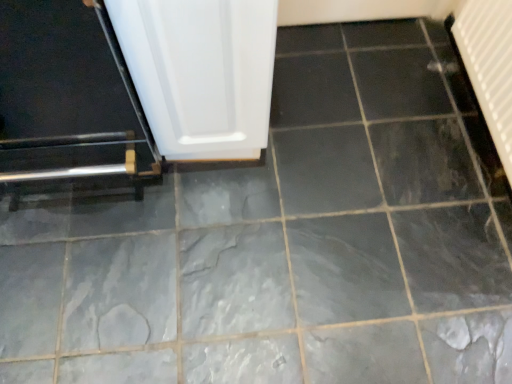
Where is `white glossy door at center`? The image size is (512, 384). white glossy door at center is located at coordinates (201, 73).

Does metallic silver door at left touch white textured radiator at upper right?

metallic silver door at left and white textured radiator at upper right are clearly separated.

Considering their positions, is metallic silver door at left located in front of or behind white textured radiator at upper right?

Clearly, metallic silver door at left is in front of white textured radiator at upper right.

Does point (10, 91) appear closer or farther from the camera than point (484, 45)?

Point (10, 91) is positioned closer to the camera compared to point (484, 45).

From the image's perspective, which is above, metallic silver door at left or white textured radiator at upper right?

metallic silver door at left appears higher in the image.

Is metallic silver door at left at the back of white glossy door at center?

That's not correct — white glossy door at center is not looking away from metallic silver door at left.

Is the surface of white glossy door at center in direct contact with metallic silver door at left?

No, white glossy door at center is not beside metallic silver door at left.

Is white glossy door at center smaller than metallic silver door at left?

Yes.

From a real-world perspective, is white glossy door at center on top of metallic silver door at left?

No, from a real-world perspective, white glossy door at center is not above metallic silver door at left.

Between metallic silver door at left and white glossy door at center, which one appears on the right side from the viewer's perspective?

From the viewer's perspective, white glossy door at center appears more on the right side.

From a real-world perspective, is metallic silver door at left on white glossy door at center?

Yes.

Is metallic silver door at left further to the viewer compared to white glossy door at center?

No, it is in front of white glossy door at center.

Does point (119, 115) appear closer or farther from the camera than point (197, 143)?

Point (119, 115) is positioned closer to the camera compared to point (197, 143).

Locate an element on the screen. The width and height of the screenshot is (512, 384). screen door that appears above the white textured radiator at upper right (from the image's perspective) is located at coordinates (x=201, y=73).

Does white glossy door at center come behind white textured radiator at upper right?

No, it is in front of white textured radiator at upper right.

From the image's perspective, is white textured radiator at upper right under white glossy door at center?

Yes, from the image's perspective, white textured radiator at upper right is below white glossy door at center.

Who is shorter, white textured radiator at upper right or white glossy door at center?

Standing shorter between the two is white textured radiator at upper right.

Is white textured radiator at upper right directly adjacent to white glossy door at center?

No, white textured radiator at upper right is not in contact with white glossy door at center.

Does white textured radiator at upper right appear on the right side of white glossy door at center?

Indeed, white textured radiator at upper right is positioned on the right side of white glossy door at center.

Considering the positions of objects white textured radiator at upper right and metallic silver door at left in the image provided, who is in front, white textured radiator at upper right or metallic silver door at left?

metallic silver door at left is closer to the camera.

Are white textured radiator at upper right and metallic silver door at left located far from each other?

That's right, there is a large distance between white textured radiator at upper right and metallic silver door at left.

Who is shorter, white textured radiator at upper right or metallic silver door at left?

white textured radiator at upper right.

Where is `radiator on the right side of metallic silver door at left`? radiator on the right side of metallic silver door at left is located at coordinates (487, 65).

This screenshot has height=384, width=512. In order to click on door that is above the white textured radiator at upper right (from a real-world perspective) in this screenshot , I will do `click(68, 104)`.

At what (x,y) coordinates should I click in order to perform the action: click on door in front of the white glossy door at center. Please return your answer as a coordinate pair (x, y). The image size is (512, 384). Looking at the image, I should click on (68, 104).

Looking at the image, which one is located closer to white glossy door at center, white textured radiator at upper right or metallic silver door at left?

Among the two, metallic silver door at left is located nearer to white glossy door at center.

When comparing their distances from white textured radiator at upper right, does metallic silver door at left or white glossy door at center seem further?

metallic silver door at left is positioned further to the anchor white textured radiator at upper right.

When comparing their distances from metallic silver door at left, does white textured radiator at upper right or white glossy door at center seem further?

Among the two, white textured radiator at upper right is located further to metallic silver door at left.

Which object lies further to the anchor point white glossy door at center, metallic silver door at left or white textured radiator at upper right?

The object further to white glossy door at center is white textured radiator at upper right.

From the image, which object appears to be nearer to metallic silver door at left, white glossy door at center or white textured radiator at upper right?

Among the two, white glossy door at center is located nearer to metallic silver door at left.

Based on their spatial positions, is white glossy door at center or metallic silver door at left closer to white textured radiator at upper right?

white glossy door at center.

In order to click on screen door between metallic silver door at left and white textured radiator at upper right from left to right in this screenshot , I will do `click(201, 73)`.